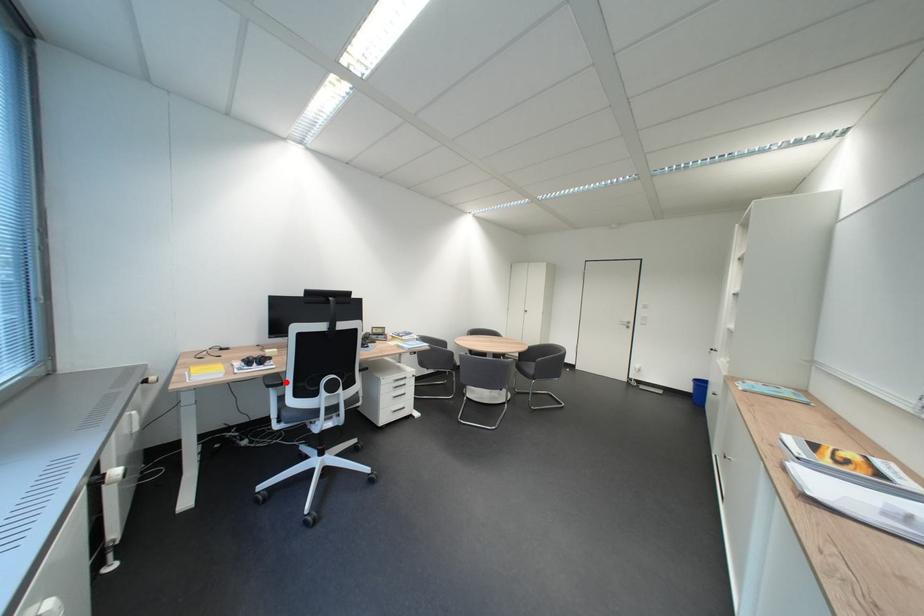
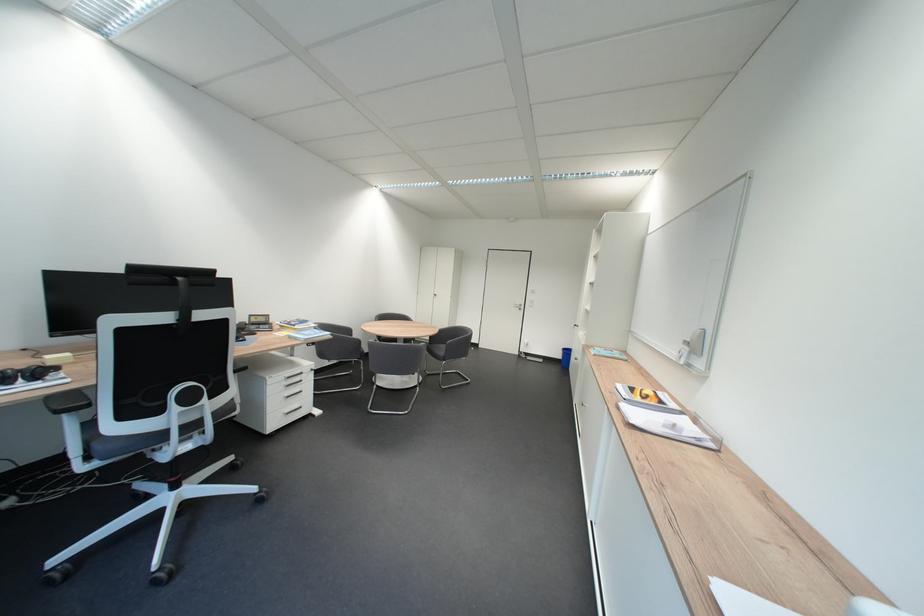
Question: A red point is marked in image1. In image2, is the corresponding 3D point closer to the camera or farther? Reply with the corresponding letter.

Choices:
 (A) The corresponding 3D point is closer.
 (B) The corresponding 3D point is farther.

Answer: (A)